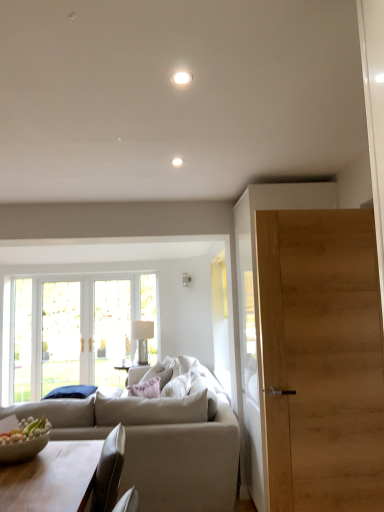
What do you see at coordinates (158, 374) in the screenshot? I see `white fabric pillow at center` at bounding box center [158, 374].

In order to face beige fabric couch at center, should I rotate leftwards or rightwards?

A 9.796 degree turn to the left will do.

This screenshot has width=384, height=512. What do you see at coordinates (51, 478) in the screenshot?
I see `light brown wooden coffee table at lower left` at bounding box center [51, 478].

Identify the location of light wood door at right. The height and width of the screenshot is (512, 384). (258, 307).

Identify the location of silver metallic lamp at center. (142, 338).

Measure the distance between white glossy ceiling light at upper center and camera.

They are 5.04 feet apart.

The image size is (384, 512). Find the location of `white fabric pillow at center`. white fabric pillow at center is located at coordinates (158, 374).

Looking at this image, which of these two, silver metallic lamp at center or beige fabric couch at center, stands taller?

Standing taller between the two is beige fabric couch at center.

From the image's perspective, is silver metallic lamp at center located above or below beige fabric couch at center?

silver metallic lamp at center is above beige fabric couch at center.

Who is more distant, silver metallic lamp at center or beige fabric couch at center?

Positioned behind is silver metallic lamp at center.

Does silver metallic lamp at center have a lesser width compared to beige fabric couch at center?

Correct, the width of silver metallic lamp at center is less than that of beige fabric couch at center.

Which is less distant, [49,458] or [306,196]?

Point [49,458] is closer to the camera than point [306,196].

Which is more to the left, light brown wooden coffee table at lower left or light wood door at right?

light brown wooden coffee table at lower left is more to the left.

Does light brown wooden coffee table at lower left turn towards light wood door at right?

No, light brown wooden coffee table at lower left is not turned towards light wood door at right.

Is light brown wooden coffee table at lower left positioned behind light wood door at right?

No, light brown wooden coffee table at lower left is closer to the camera.

From a real-world perspective, which is physically below, light brown wooden coffee table at lower left or beige fabric couch at center?

From a 3D spatial view, beige fabric couch at center is below.

Is light brown wooden coffee table at lower left taller than beige fabric couch at center?

No.

Looking at this image, which of these two, light brown wooden coffee table at lower left or beige fabric couch at center, is wider?

beige fabric couch at center.

Between light brown wooden coffee table at lower left and beige fabric couch at center, which one is positioned behind?

beige fabric couch at center is further from the camera.

Choose the correct answer: Is white glossy ceiling light at upper center inside silver metallic lamp at center or outside it?

The correct answer is: outside.

Which of these two, white glossy ceiling light at upper center or silver metallic lamp at center, is bigger?

silver metallic lamp at center.

Considering the sizes of objects white glossy ceiling light at upper center and silver metallic lamp at center in the image provided, who is thinner, white glossy ceiling light at upper center or silver metallic lamp at center?

Thinner between the two is white glossy ceiling light at upper center.

From the image's perspective, which is below, white glossy ceiling light at upper center or silver metallic lamp at center?

silver metallic lamp at center.

Which is more to the right, white glossy ceiling light at upper center or white fabric pillow at center?

Positioned to the right is white glossy ceiling light at upper center.

Which is more distant, (x=184, y=74) or (x=152, y=374)?

The point (x=152, y=374) is farther.

Which object is closer to the camera, white glossy ceiling light at upper center or white fabric pillow at center?

white glossy ceiling light at upper center is closer to the camera.

From a real-world perspective, between white glossy ceiling light at upper center and white fabric pillow at center, who is vertically higher?

white glossy ceiling light at upper center.

Considering the positions of objects silver metallic lamp at center and light wood door at right in the image provided, who is more to the right, silver metallic lamp at center or light wood door at right?

Positioned to the right is light wood door at right.

Is point (148, 322) farther from viewer compared to point (253, 295)?

Yes.

From the image's perspective, does silver metallic lamp at center appear lower than light wood door at right?

Yes, from the image's perspective, silver metallic lamp at center is below light wood door at right.

From a real-world perspective, is silver metallic lamp at center physically located above or below light wood door at right?

silver metallic lamp at center is situated lower than light wood door at right in the real world.

Is light brown wooden coffee table at lower left not close to white glossy ceiling light at upper center?

light brown wooden coffee table at lower left is far away from white glossy ceiling light at upper center.

Is point (95, 451) behind point (181, 73)?

Yes, point (95, 451) is farther from viewer.

Is light brown wooden coffee table at lower left in front of or behind white glossy ceiling light at upper center in the image?

light brown wooden coffee table at lower left is positioned farther from the viewer than white glossy ceiling light at upper center.

Where is `studio couch directly beneath the silver metallic lamp at center (from a real-world perspective)`? This screenshot has width=384, height=512. studio couch directly beneath the silver metallic lamp at center (from a real-world perspective) is located at coordinates coord(160,451).

Identify the location of cabinetry that is on the right side of light brown wooden coffee table at lower left. The height and width of the screenshot is (512, 384). (258, 307).

Estimate the real-world distances between objects in this image. Which object is further from white fabric pillow at center, light wood door at right or white glossy ceiling light at upper center?

white glossy ceiling light at upper center lies further to white fabric pillow at center than the other object.

Considering their positions, is white fabric pillow at center positioned further to light wood door at right than beige fabric couch at center?

The object further to light wood door at right is white fabric pillow at center.

Based on their spatial positions, is beige fabric couch at center or light wood door at right closer to white glossy ceiling light at upper center?

light wood door at right lies closer to white glossy ceiling light at upper center than the other object.

From the image, which object appears to be nearer to white glossy ceiling light at upper center, light brown wooden coffee table at lower left or silver metallic lamp at center?

light brown wooden coffee table at lower left is positioned closer to the anchor white glossy ceiling light at upper center.

Estimate the real-world distances between objects in this image. Which object is closer to white glossy ceiling light at upper center, light wood door at right or white fabric pillow at center?

light wood door at right is positioned closer to the anchor white glossy ceiling light at upper center.

When comparing their distances from white fabric pillow at center, does white glossy ceiling light at upper center or beige fabric couch at center seem closer?

Based on the image, beige fabric couch at center appears to be nearer to white fabric pillow at center.

When comparing their distances from white glossy ceiling light at upper center, does white fabric pillow at center or silver metallic lamp at center seem closer?

Among the two, white fabric pillow at center is located nearer to white glossy ceiling light at upper center.

From the image, which object appears to be farther from light brown wooden coffee table at lower left, white fabric pillow at center or silver metallic lamp at center?

silver metallic lamp at center lies further to light brown wooden coffee table at lower left than the other object.

Where is `cabinetry between white glossy ceiling light at upper center and beige fabric couch at center from top to bottom`? The height and width of the screenshot is (512, 384). cabinetry between white glossy ceiling light at upper center and beige fabric couch at center from top to bottom is located at coordinates (258, 307).

Where is `pillow positioned between light wood door at right and silver metallic lamp at center from near to far`? pillow positioned between light wood door at right and silver metallic lamp at center from near to far is located at coordinates (158, 374).

At what (x,y) coordinates should I click in order to perform the action: click on coffee table between white glossy ceiling light at upper center and beige fabric couch at center vertically. Please return your answer as a coordinate pair (x, y). The height and width of the screenshot is (512, 384). Looking at the image, I should click on (51, 478).

Where is `cabinetry that lies between white glossy ceiling light at upper center and light brown wooden coffee table at lower left from top to bottom`? This screenshot has height=512, width=384. cabinetry that lies between white glossy ceiling light at upper center and light brown wooden coffee table at lower left from top to bottom is located at coordinates (258, 307).